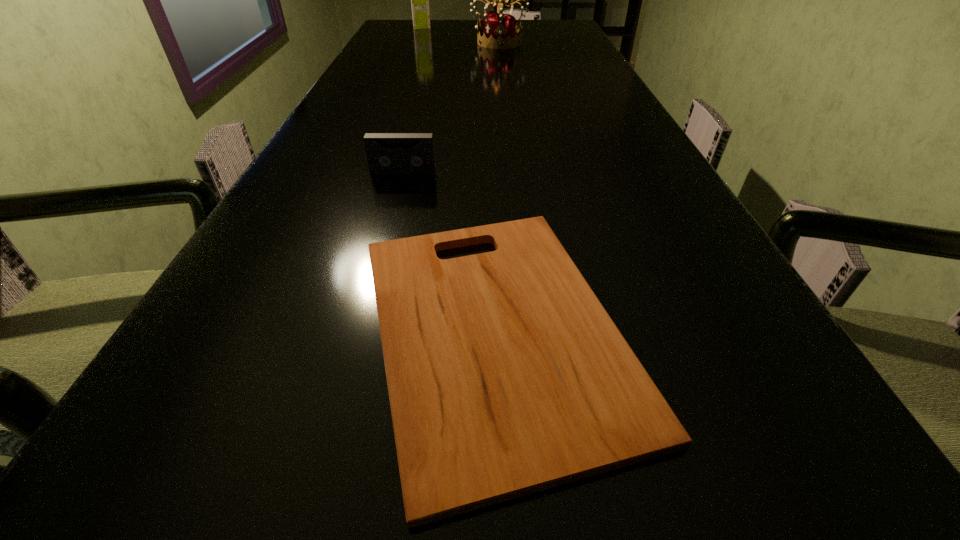
Identify which object is located as the nearest to the second farthest object. Please provide its 2D coordinates. Your answer should be formatted as a tuple, i.e. [(x, y)], where the tuple contains the x and y coordinates of a point satisfying the conditions above.

[(419, 0)]

The height and width of the screenshot is (540, 960). I want to click on object identified as the third closest to the shortest object, so click(x=419, y=0).

Where is `free point that satisfies the following two spatial constraints: 1. on the front side of the chopping board; 2. on the left side of the soya milk`? The height and width of the screenshot is (540, 960). free point that satisfies the following two spatial constraints: 1. on the front side of the chopping board; 2. on the left side of the soya milk is located at coordinates (302, 329).

The height and width of the screenshot is (540, 960). I want to click on free space in the image that satisfies the following two spatial constraints: 1. on the front side of the soya milk; 2. on the right side of the shortest object, so click(302, 329).